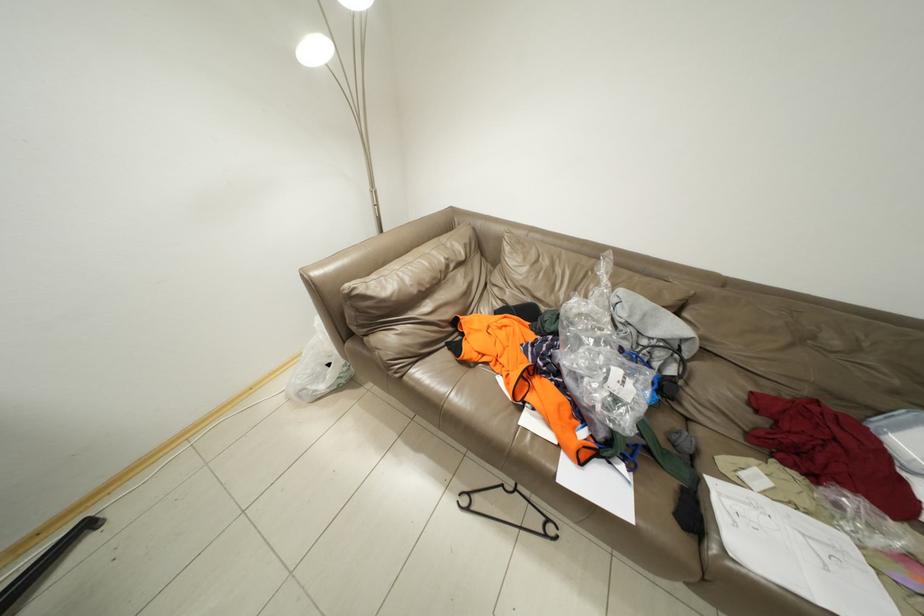
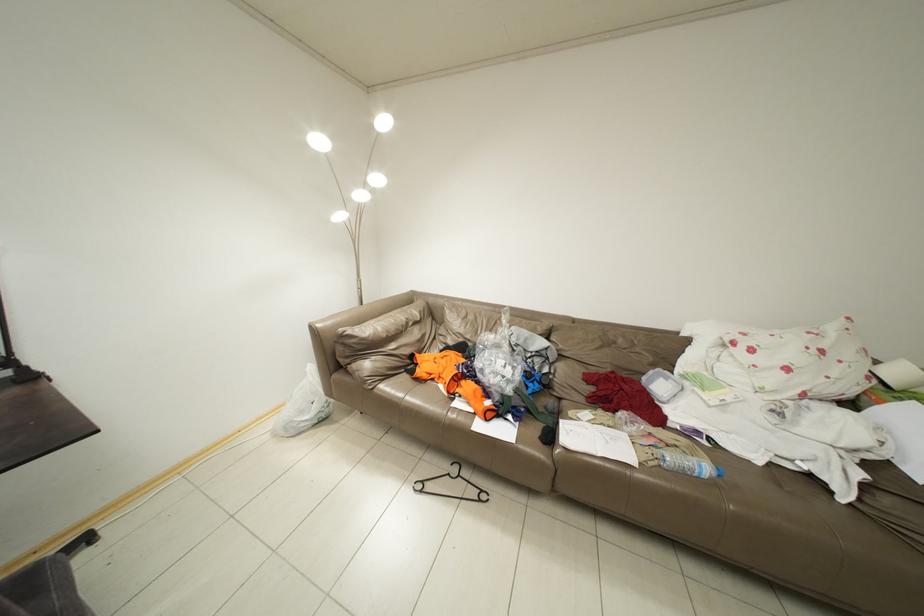
Question: The images are taken continuously from a first-person perspective. In which direction is your viewpoint rotating?

Choices:
 (A) Left
 (B) Right
 (C) Up
 (D) Down

Answer: (C)